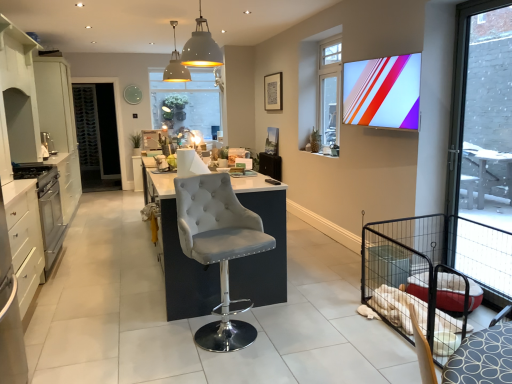
Describe the element at coordinates (383, 92) in the screenshot. The height and width of the screenshot is (384, 512). I see `matte plastic tv at upper right` at that location.

Measure the distance between point (18, 232) and camera.

Point (18, 232) is 8.82 feet from camera.

What do you see at coordinates (329, 94) in the screenshot? This screenshot has width=512, height=384. I see `clear glass window at upper center, acting as the second window starting from the front` at bounding box center [329, 94].

Where is `silver metallic oven at left, the 2th appliance viewed from the front`? silver metallic oven at left, the 2th appliance viewed from the front is located at coordinates (46, 206).

What is the approximate width of translucent glass window at center, the third window viewed from the front?

It is 3.61 inches.

Locate an element on the screen. This screenshot has height=384, width=512. velvet grey bar stool at center is located at coordinates (219, 249).

Is matte plastic tv at upper right looking in the opposite direction of white matte pendant lamp at upper center, which appears as the first light fixture when viewed from the front?

No, matte plastic tv at upper right is not facing the opposite direction of white matte pendant lamp at upper center, which appears as the first light fixture when viewed from the front.

You are a GUI agent. You are given a task and a screenshot of the screen. Output one action in this format:
    pyautogui.click(x=<x>, y=<y>)
    Task: Click on the window screen below the white matte pendant lamp at upper center, the second light fixture positioned from the back (from a real-world perspective)
    
    Given the screenshot: What is the action you would take?
    pyautogui.click(x=383, y=92)

Looking at this image, would you say matte plastic tv at upper right is outside white matte pendant lamp at upper center, which ranks as the 1th light fixture in right-to-left order?

→ Yes, matte plastic tv at upper right is outside of white matte pendant lamp at upper center, which ranks as the 1th light fixture in right-to-left order.

How different are the orientations of matte plastic tv at upper right and white matte pendant lamp at upper center, which ranks as the 1th light fixture in right-to-left order, in degrees?

92.7 degrees separate the facing orientations of matte plastic tv at upper right and white matte pendant lamp at upper center, which ranks as the 1th light fixture in right-to-left order.

In order to click on picture frame lying behind the white matte pendant lamp at upper center, which appears as the first light fixture when viewed from the front in this screenshot , I will do `click(273, 92)`.

Would you say matte white picture frame at upper center is a long distance from white matte pendant lamp at upper center, the 2th light fixture in the left-to-right sequence?

Yes, matte white picture frame at upper center is far from white matte pendant lamp at upper center, the 2th light fixture in the left-to-right sequence.

Is matte white picture frame at upper center aimed at white matte pendant lamp at upper center, which appears as the first light fixture when viewed from the front?

No, matte white picture frame at upper center is not oriented towards white matte pendant lamp at upper center, which appears as the first light fixture when viewed from the front.

Measure the distance between matte white picture frame at upper center and white matte pendant lamp at upper center, the second light fixture positioned from the back.

matte white picture frame at upper center and white matte pendant lamp at upper center, the second light fixture positioned from the back, are 9.72 feet apart.

Does matte white picture frame at upper center have a greater width compared to satin silver toaster at left, the first appliance when ordered from back to front?

In fact, matte white picture frame at upper center might be narrower than satin silver toaster at left, the first appliance when ordered from back to front.

Between matte white picture frame at upper center and satin silver toaster at left, the third appliance in the bottom-to-top sequence, which one has more height?

With more height is matte white picture frame at upper center.

Image resolution: width=512 pixels, height=384 pixels. Find the location of `the 1st appliance directly beneath the matte white picture frame at upper center (from a real-world perspective)`. the 1st appliance directly beneath the matte white picture frame at upper center (from a real-world perspective) is located at coordinates (48, 143).

From a real-world perspective, which object stands above the other?

translucent glass window at center, the 3th window from the right.

Is translucent glass window at center, acting as the first window starting from the left, facing away from satin silver oven at left, the second appliance in the bottom-to-top sequence?

No, translucent glass window at center, acting as the first window starting from the left,'s orientation is not away from satin silver oven at left, the second appliance in the bottom-to-top sequence.

The image size is (512, 384). I want to click on the 3rd window positioned above the satin silver oven at left, the second appliance viewed from the top (from the image's perspective), so click(187, 101).

Is translucent glass window at center, the third window viewed from the front, shorter than satin silver oven at left, arranged as the 1th appliance when viewed from the front?

In fact, translucent glass window at center, the third window viewed from the front, may be taller than satin silver oven at left, arranged as the 1th appliance when viewed from the front.

Which is farther from the camera, (154,115) or (47,133)?

The point (154,115) is more distant.

Which object is further away from the camera, translucent glass window at center, which ranks as the first window in back-to-front order, or satin silver toaster at left, the first appliance when ordered from back to front?

translucent glass window at center, which ranks as the first window in back-to-front order, is more distant.

Does translucent glass window at center, the 3th window from the right, have a lesser width compared to satin silver toaster at left, the first appliance when ordered from back to front?

Indeed, translucent glass window at center, the 3th window from the right, has a lesser width compared to satin silver toaster at left, the first appliance when ordered from back to front.

How many degrees apart are the facing directions of translucent glass window at center, the 3th window from the right, and satin silver toaster at left, the third appliance in the bottom-to-top sequence?

There is a 92.2-degree angle between the facing directions of translucent glass window at center, the 3th window from the right, and satin silver toaster at left, the third appliance in the bottom-to-top sequence.

Which is more to the right, satin silver toaster at left, the third appliance in the bottom-to-top sequence, or velvet grey bar stool at center?

Result: velvet grey bar stool at center.

From a real-world perspective, is satin silver toaster at left, the 3th appliance when ordered from front to back, over velvet grey bar stool at center?

Yes, from a real-world perspective, satin silver toaster at left, the 3th appliance when ordered from front to back, is on top of velvet grey bar stool at center.

I want to click on chair on the right of satin silver toaster at left, the third appliance in the bottom-to-top sequence, so click(x=219, y=249).

Does point (46, 141) appear closer or farther from the camera than point (231, 185)?

Clearly, point (46, 141) is more distant from the camera than point (231, 185).

Considering the relative positions of clear glass window at upper center, acting as the second window starting from the front, and white glossy cabinet at left, the first cabinetry when ordered from right to left, in the image provided, is clear glass window at upper center, acting as the second window starting from the front, to the left of white glossy cabinet at left, the first cabinetry when ordered from right to left, from the viewer's perspective?

Incorrect, clear glass window at upper center, acting as the second window starting from the front, is not on the left side of white glossy cabinet at left, the first cabinetry when ordered from right to left.

Find the location of a particular element. The height and width of the screenshot is (384, 512). the 3rd window positioned above the white glossy cabinet at left, which is counted as the 2th cabinetry, starting from the left (from a real-world perspective) is located at coordinates (329, 94).

Is clear glass window at upper center, the 2th window viewed from the back, in front of white glossy cabinet at left, which ranks as the second cabinetry in back-to-front order?

No, clear glass window at upper center, the 2th window viewed from the back, is behind white glossy cabinet at left, which ranks as the second cabinetry in back-to-front order.

Considering the relative sizes of clear glass window at upper center, which appears as the 2th window when viewed from the right, and white glossy cabinet at left, the first cabinetry when ordered from right to left, in the image provided, is clear glass window at upper center, which appears as the 2th window when viewed from the right, bigger than white glossy cabinet at left, the first cabinetry when ordered from right to left,?

No.

From the matte plastic tv at upper right, count 1st light fixtures backward and point to it. Please provide its 2D coordinates.

[(201, 47)]

This screenshot has height=384, width=512. What are the coordinates of `the 1st light fixture counting from the left side of the matte white picture frame at upper center` in the screenshot? It's located at (201, 47).

From the image, which object appears to be farther from velvet grey bar stool at center, satin silver toaster at left, the 1th appliance viewed from the top, or clear glass window at upper center, the 2th window viewed from the back?

satin silver toaster at left, the 1th appliance viewed from the top.

Looking at the image, which one is located closer to matte plastic tv at upper right, clear glass door at right, acting as the third window starting from the back, or velvet grey bar stool at center?

Among the two, clear glass door at right, acting as the third window starting from the back, is located nearer to matte plastic tv at upper right.

From the image, which object appears to be nearer to clear glass window at upper center, acting as the second window starting from the front, matte plastic tv at upper right or translucent glass window at center, the third window viewed from the front?

matte plastic tv at upper right lies closer to clear glass window at upper center, acting as the second window starting from the front, than the other object.

Considering their positions, is white matte pendant lamp at upper center, the 2th light fixture in the left-to-right sequence, positioned closer to clear glass window at upper center, which appears as the 2th window when viewed from the right, than gray fabric armchair at center?

The object closer to clear glass window at upper center, which appears as the 2th window when viewed from the right, is white matte pendant lamp at upper center, the 2th light fixture in the left-to-right sequence.

Looking at this image, estimate the real-world distances between objects in this image. Which object is closer to satin silver toaster at left, the third appliance in the bottom-to-top sequence, black mesh screen door at left or white glossy cabinet at left, which ranks as the second cabinetry in back-to-front order?

The object closer to satin silver toaster at left, the third appliance in the bottom-to-top sequence, is black mesh screen door at left.

Based on their spatial positions, is satin silver toaster at left, the third appliance in the bottom-to-top sequence, or matte white picture frame at upper center further from black mesh screen door at left?

matte white picture frame at upper center lies further to black mesh screen door at left than the other object.

From the image, which object appears to be nearer to black mesh screen door at left, clear glass door at right, the 1th window when ordered from right to left, or matte plastic tv at upper right?

matte plastic tv at upper right is positioned closer to the anchor black mesh screen door at left.

When comparing their distances from matte white picture frame at upper center, does matte white dome at center, arranged as the first light fixture when viewed from the back, or translucent glass window at center, the third window viewed from the front, seem further?

matte white dome at center, arranged as the first light fixture when viewed from the back, is further to matte white picture frame at upper center.

I want to click on cabinetry between silver metallic oven at left, the 2th appliance viewed from the front, and gray fabric armchair at center from left to right, so click(x=25, y=242).

At what (x,y) coordinates should I click in order to perform the action: click on chair located between gray fabric armchair at center and matte plastic tv at upper right in the left-right direction. Please return your answer as a coordinate pair (x, y). The height and width of the screenshot is (384, 512). Looking at the image, I should click on (219, 249).

The height and width of the screenshot is (384, 512). What are the coordinates of `light fixture positioned between gray fabric armchair at center and matte white dome at center, the second light fixture viewed from the front, from near to far` in the screenshot? It's located at (x=201, y=47).

Locate an element on the screen. This screenshot has width=512, height=384. armchair situated between white glossy cabinet at left, which is counted as the 2th cabinetry, starting from the left, and velvet grey bar stool at center from left to right is located at coordinates (190, 163).